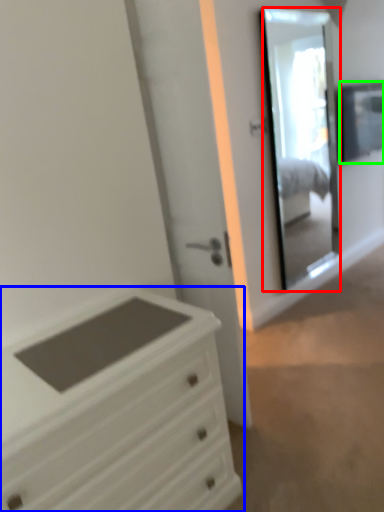
Question: Which object is the farthest from mirror (highlighted by a red box)? Choose among these: chest of drawers (highlighted by a blue box) or window (highlighted by a green box).

Choices:
 (A) chest of drawers
 (B) window

Answer: (A)